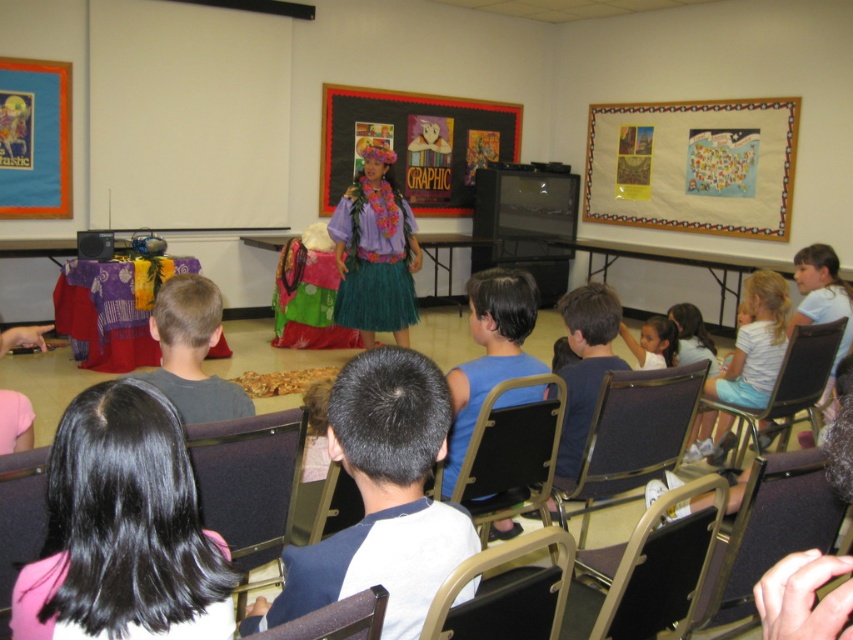
Question: Among these points, which one is nearest to the camera?

Choices:
 (A) (45, 458)
 (B) (705, 490)

Answer: (A)

Question: Which point is farther to the camera?

Choices:
 (A) black leather chair at lower center
 (B) black hair at center
 (C) metallic gold chair at center
 (D) dark blue fabric chair at lower right

Answer: (D)

Question: Can you confirm if black hair at center is positioned below black fabric chair at lower center?

Choices:
 (A) yes
 (B) no

Answer: (B)

Question: Which of these objects is positioned closest to the teal grass skirt at center?

Choices:
 (A) metallic gold chair at center
 (B) black hair at center

Answer: (A)

Question: Is the position of black plastic chair at right more distant than that of light brown skin at center?

Choices:
 (A) no
 (B) yes

Answer: (A)

Question: Observing the image, what is the correct spatial positioning of metallic gold chair at center in reference to brown leather chair at lower center?

Choices:
 (A) left
 (B) right

Answer: (B)